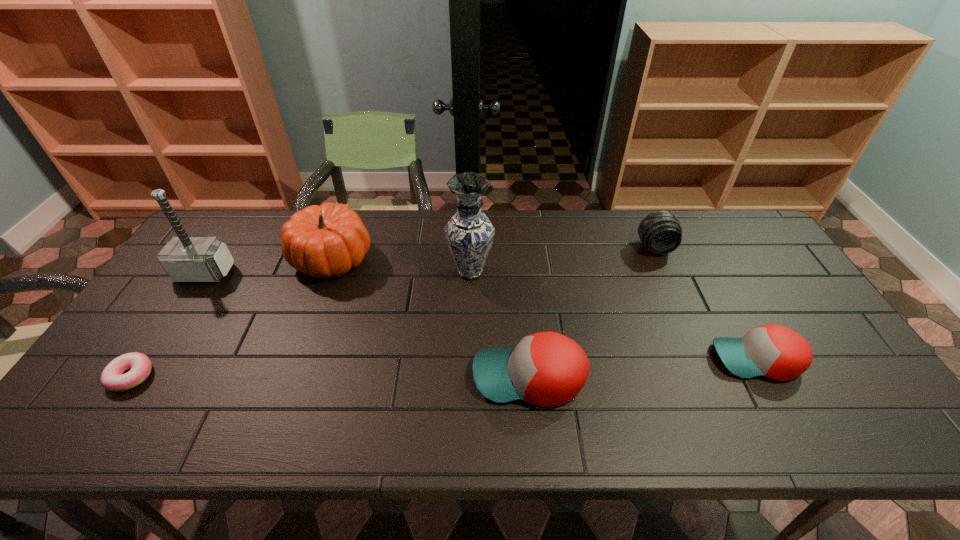
This screenshot has height=540, width=960. Identify the location of vacant area at the left edge. (180, 309).

In the image, there is a desktop. Identify the location of blank space at the right edge. This screenshot has height=540, width=960. (827, 332).

The image size is (960, 540). What are the coordinates of `vacant space at the far left corner of the desktop` in the screenshot? It's located at (213, 218).

Identify the location of free spot between the shortest object and the telephoto lens. (394, 312).

In order to click on free point between the telephoto lens and the vase in this screenshot , I will do `click(563, 260)`.

Where is `vacant point located between the hammer and the doughnut`? vacant point located between the hammer and the doughnut is located at coordinates (168, 325).

The image size is (960, 540). I want to click on free area in between the hammer and the taller baseball cap, so click(367, 325).

The image size is (960, 540). Find the location of `vacant space in between the vase and the right baseball cap`. vacant space in between the vase and the right baseball cap is located at coordinates (613, 316).

I want to click on vacant space that's between the doughnut and the sixth tallest object, so click(x=444, y=368).

I want to click on vacant space in between the fifth object from right to left and the hammer, so click(x=269, y=266).